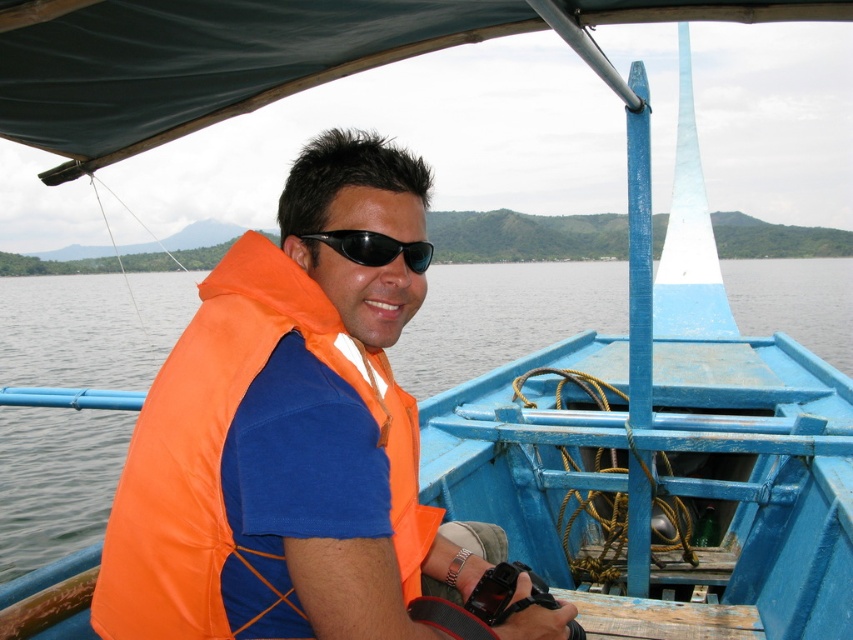
You are a photographer trying to capture the orange fabric life jacket at left and the black plastic sunglasses at center in your shot. Which object should you zoom in more on to ensure both are clearly visible?

The orange fabric life jacket at left might be wider than black plastic sunglasses at center, so you should zoom in more on the black plastic sunglasses at center to ensure both are clearly visible.

You are a photographer trying to capture the orange fabric life jacket at left and the black plastic sunglasses at center. Which object should you zoom in on to ensure both are in focus?

The orange fabric life jacket at left is much taller than the black plastic sunglasses at center, so you should zoom in on the orange fabric life jacket at left to ensure both are in focus.

You are standing on the dock and want to toss a small item to the person wearing the orange fabric life jacket at left. If your throwing distance is 1.2 meters, will you be able to reach them?

The orange fabric life jacket at left and the viewer are 1.14 meters apart from each other. Since your throwing distance is 1.2 meters, you can successfully reach them by tossing the item.